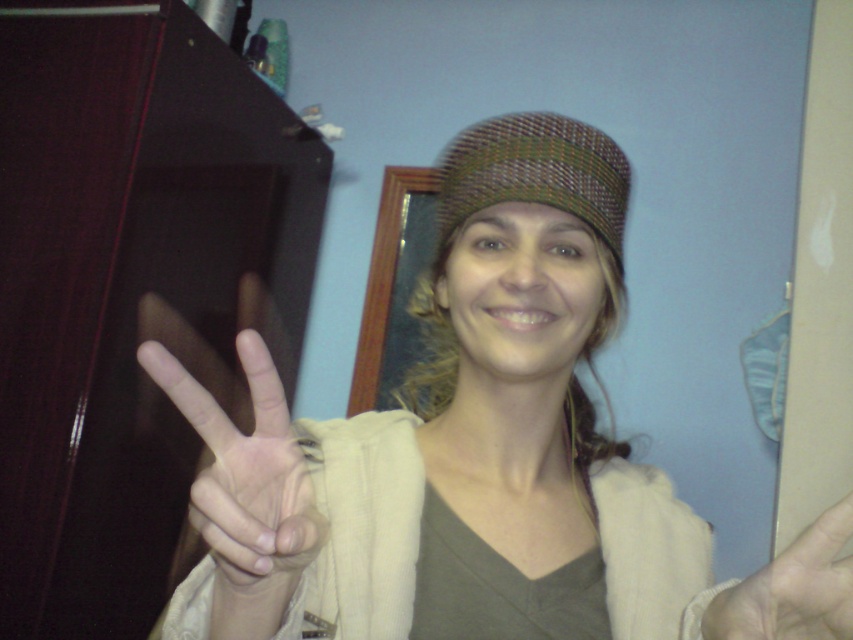
Question: Which point appears closest to the camera in this image?

Choices:
 (A) (849, 593)
 (B) (364, 554)
 (C) (224, 467)
 (D) (529, 138)

Answer: (A)

Question: Which of the following is the closest to the observer?

Choices:
 (A) white matte hand at center
 (B) matte beige hand at center
 (C) woolen knit cap at center
 (D) woven fabric hat at center

Answer: (A)

Question: Considering the real-world distances, which object is farthest from the white matte hand at center?

Choices:
 (A) woolen knit cap at center
 (B) matte beige hand at center
 (C) woven fabric hat at center

Answer: (C)

Question: Can you confirm if white matte hand at center is wider than woven fabric hat at center?

Choices:
 (A) no
 (B) yes

Answer: (A)

Question: Is woolen knit cap at center bigger than woven fabric hat at center?

Choices:
 (A) no
 (B) yes

Answer: (B)

Question: Does white matte hand at center appear on the right side of woven fabric hat at center?

Choices:
 (A) no
 (B) yes

Answer: (A)